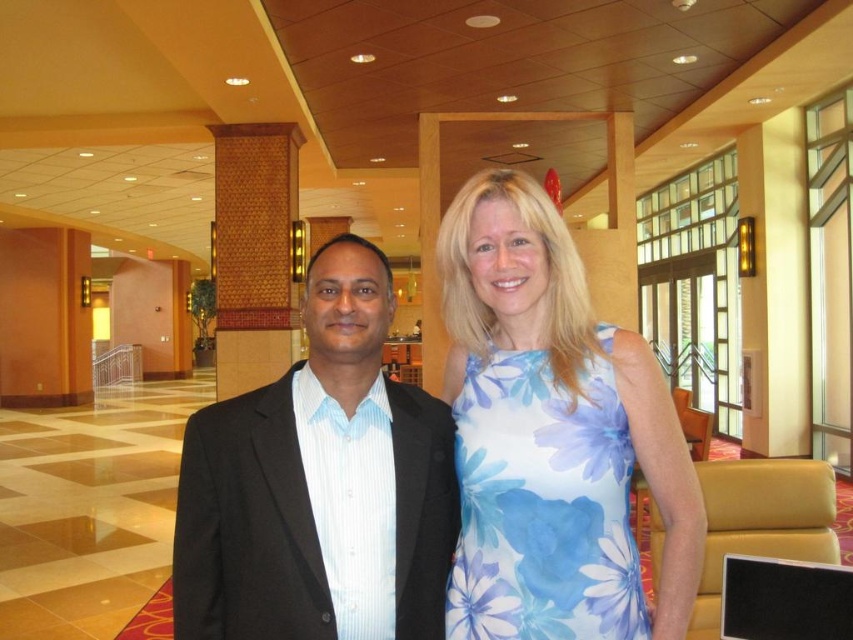
Question: Which object appears farthest from the camera in this image?

Choices:
 (A) blue floral dress at center
 (B) floral-patterned fabric dress at center
 (C) black matte suit at center

Answer: (A)

Question: In this image, where is black matte suit at center located relative to floral-patterned fabric dress at center?

Choices:
 (A) right
 (B) left

Answer: (B)

Question: Which point is farther to the camera?

Choices:
 (A) (627, 602)
 (B) (682, 636)
 (C) (204, 611)

Answer: (C)

Question: Which object is positioned closest to the black matte suit at center?

Choices:
 (A) floral-patterned fabric dress at center
 (B) blue floral dress at center

Answer: (A)

Question: Is blue floral dress at center positioned at the back of floral-patterned fabric dress at center?

Choices:
 (A) yes
 (B) no

Answer: (A)

Question: Is the position of blue floral dress at center more distant than that of floral-patterned fabric dress at center?

Choices:
 (A) no
 (B) yes

Answer: (B)